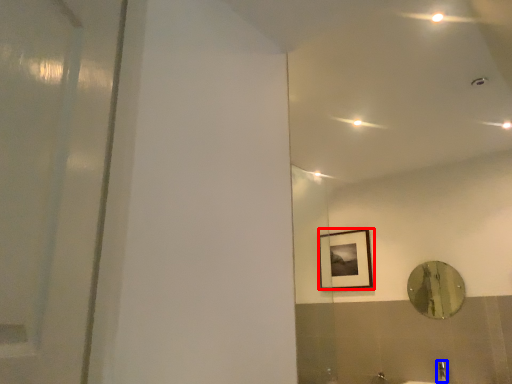
Question: Which object is closer to the camera taking this photo, picture frame (highlighted by a red box) or faucet (highlighted by a blue box)?

Choices:
 (A) picture frame
 (B) faucet

Answer: (B)